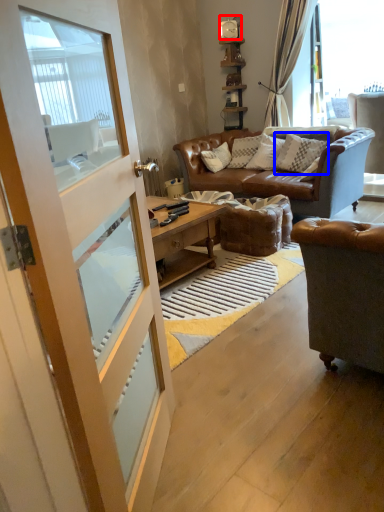
Question: Which of the following is the closest to the observer, clock (highlighted by a red box) or pillow (highlighted by a blue box)?

Choices:
 (A) clock
 (B) pillow

Answer: (B)